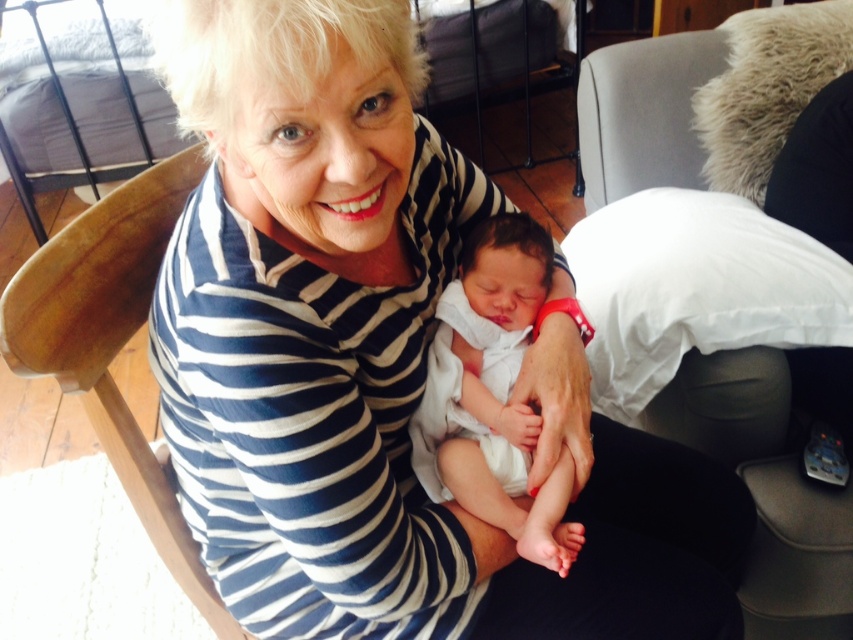
Is point (277, 563) behind point (740, 397)?

No, (277, 563) is in front of (740, 397).

Is point (296, 312) less distant than point (695, 195)?

Yes.

The image size is (853, 640). I want to click on white striped shirt at center, so click(380, 364).

Is white striped shirt at center in front of white soft cloth at center?

Yes, white striped shirt at center is in front of white soft cloth at center.

Can you confirm if white striped shirt at center is wider than white soft cloth at center?

Yes.

Is point (418, 276) positioned after point (468, 392)?

No.

Where is `white striped shirt at center`? Image resolution: width=853 pixels, height=640 pixels. white striped shirt at center is located at coordinates (380, 364).

Is white fabric armchair at lower right below white soft cloth at center?

No, white fabric armchair at lower right is not below white soft cloth at center.

Which of these two, white fabric armchair at lower right or white soft cloth at center, stands taller?

white fabric armchair at lower right is taller.

Who is more forward, (796,628) or (456,396)?

Point (456,396) is more forward.

Where is `white fabric armchair at lower right`? This screenshot has width=853, height=640. white fabric armchair at lower right is located at coordinates (718, 278).